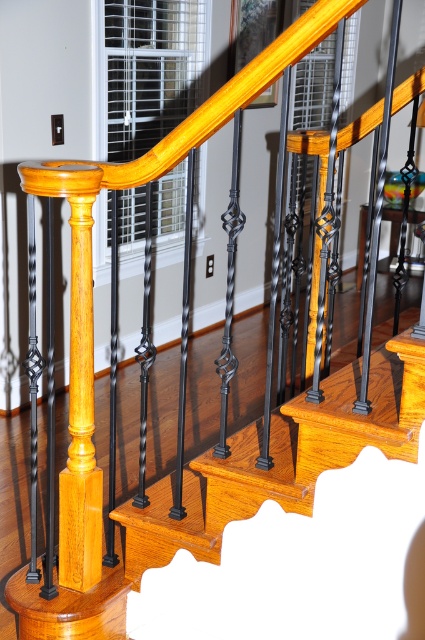
You are standing at the base of the staircase and notice the matte black wrought iron at center. Based on its coordinates, is it positioned closer to the top of the staircase or the bottom?

The matte black wrought iron at center is located at point coordinates closer to the top of the staircase since the y coordinate 0.666 is closer to 1.0 than 0.0, meaning it is higher up the staircase.